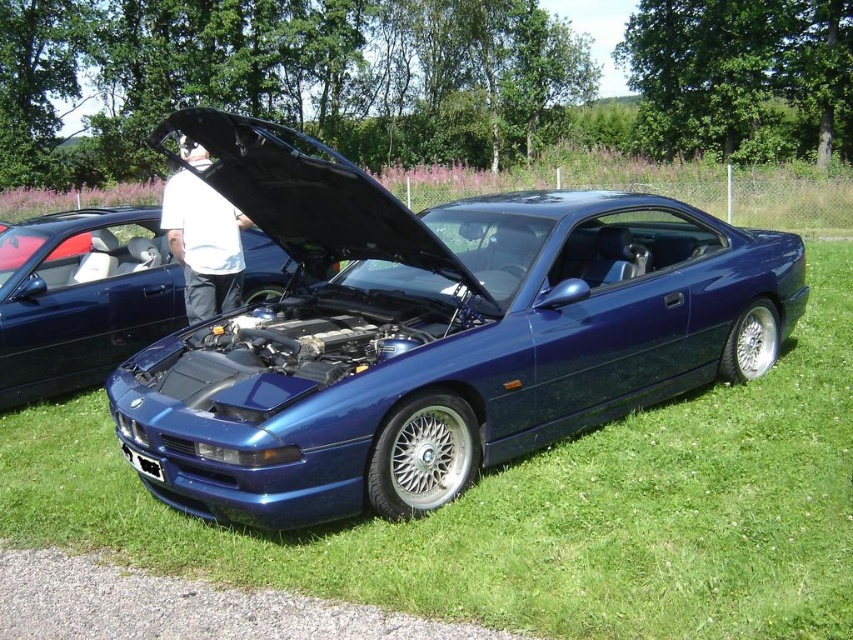
Question: Which point appears farthest from the camera in this image?

Choices:
 (A) click(279, 284)
 (B) click(643, 550)
 (C) click(167, 208)
 (D) click(119, 381)

Answer: (A)

Question: Does green grass at center lie in front of metallic blue engine at center?

Choices:
 (A) no
 (B) yes

Answer: (B)

Question: Can you confirm if metallic blue engine at center is positioned above white matte shirt at center?

Choices:
 (A) yes
 (B) no

Answer: (B)

Question: Which point is farther from the camera taking this photo?

Choices:
 (A) (91, 326)
 (B) (320, 422)

Answer: (A)

Question: Can you confirm if metallic blue car at center is positioned to the left of white matte shirt at center?

Choices:
 (A) no
 (B) yes

Answer: (A)

Question: Which point is farther to the camera?

Choices:
 (A) metallic blue engine at center
 (B) white matte shirt at center

Answer: (A)